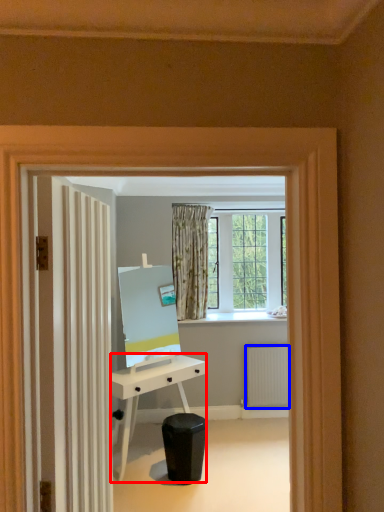
Question: Which point is further to the camera, desk (highlighted by a red box) or radiator (highlighted by a blue box)?

Choices:
 (A) desk
 (B) radiator

Answer: (B)